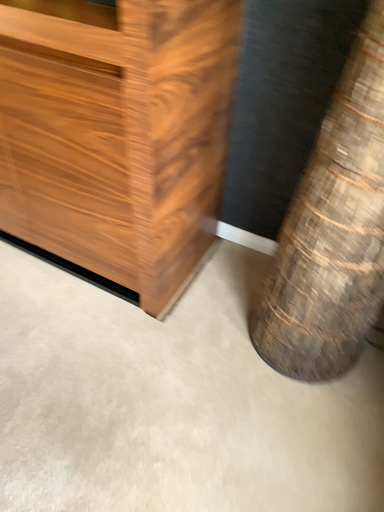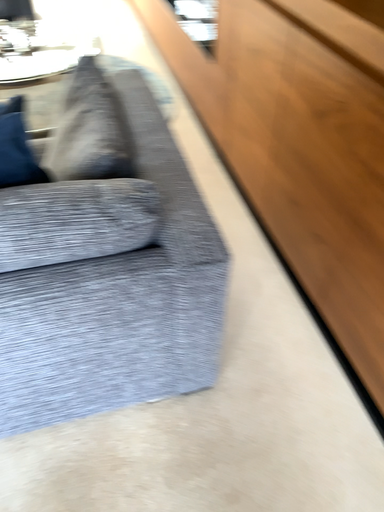
Question: Which way did the camera rotate in the video?

Choices:
 (A) rotated downward
 (B) rotated upward

Answer: (B)